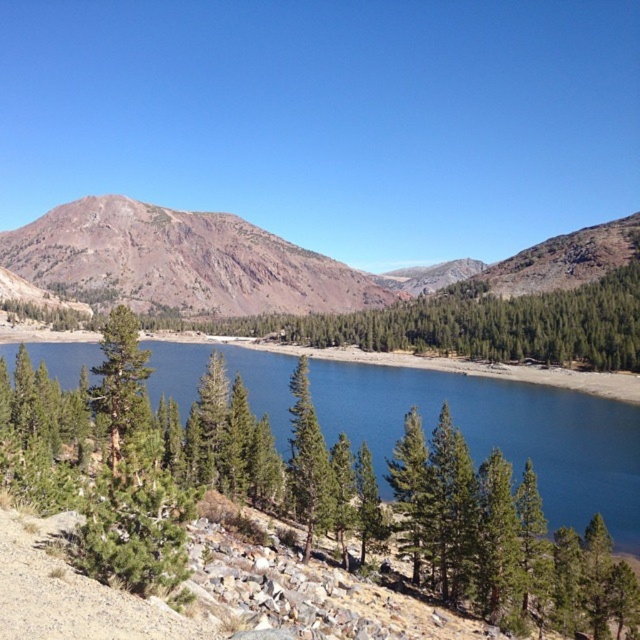
Question: In this image, where is blue glassy water at center located relative to brown rocky mountain at upper left?

Choices:
 (A) below
 (B) above

Answer: (A)

Question: Does blue glassy water at center have a smaller size compared to green textured tree at center?

Choices:
 (A) no
 (B) yes

Answer: (B)

Question: Which point is closer to the camera taking this photo?

Choices:
 (A) (120, 392)
 (B) (193, 380)
 (C) (605, 346)
 (D) (236, 216)

Answer: (A)

Question: Which object appears closest to the camera in this image?

Choices:
 (A) green matte tree at left
 (B) green textured tree at center
 (C) brown rocky mountain at upper left
 (D) blue glassy water at center

Answer: (A)

Question: Which object is closer to the camera taking this photo?

Choices:
 (A) brown rocky mountain at upper left
 (B) green textured tree at center
 (C) green matte tree at left

Answer: (C)

Question: Is blue glassy water at center smaller than green textured tree at center?

Choices:
 (A) yes
 (B) no

Answer: (A)